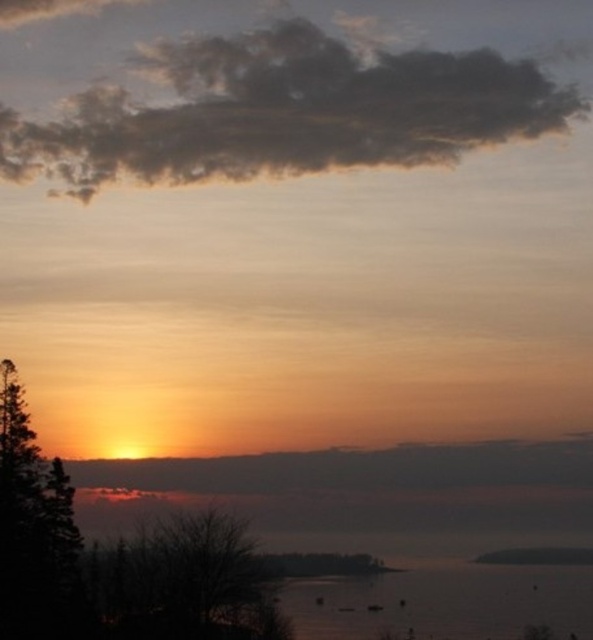
Question: Which point is closer to the camera taking this photo?

Choices:
 (A) (205, 132)
 (B) (546, 605)

Answer: (B)

Question: Can you confirm if silvery reflective water at lower center is wider than dark green leafy tree at left?

Choices:
 (A) no
 (B) yes

Answer: (B)

Question: Is silvery reflective water at lower center positioned in front of dark green leafy tree at left?

Choices:
 (A) no
 (B) yes

Answer: (A)

Question: Among these points, which one is farthest from the camera?

Choices:
 (A) (511, 632)
 (B) (24, 580)

Answer: (A)

Question: Does dark gray fluffy cloud at upper center come behind silvery reflective water at lower center?

Choices:
 (A) no
 (B) yes

Answer: (B)

Question: Which object is closer to the camera taking this photo?

Choices:
 (A) dark gray fluffy cloud at upper center
 (B) silvery reflective water at lower center
 (C) dark green leafy tree at left

Answer: (C)